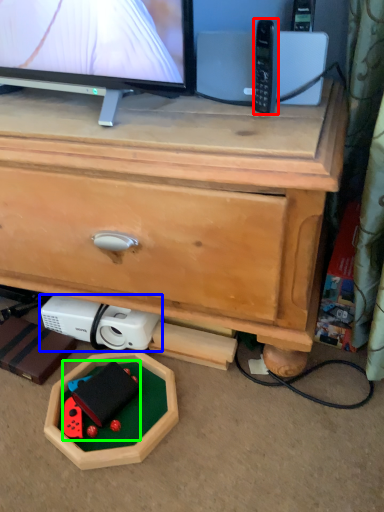
Question: Estimate the real-world distances between objects in this image. Which object is closer to control (highlighted by a red box), appliance (highlighted by a blue box) or toy (highlighted by a green box)?

Choices:
 (A) appliance
 (B) toy

Answer: (A)